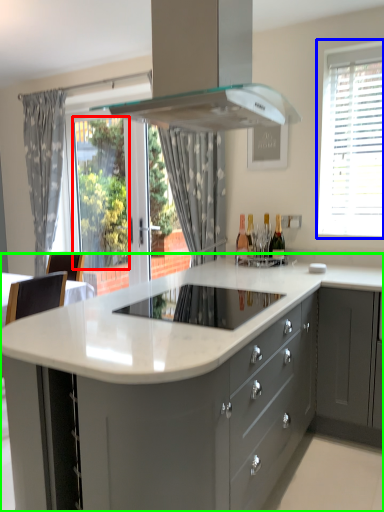
Question: Considering the real-world distances, which object is closest to window screen (highlighted by a red box)? window (highlighted by a blue box) or countertop (highlighted by a green box).

Choices:
 (A) window
 (B) countertop

Answer: (A)